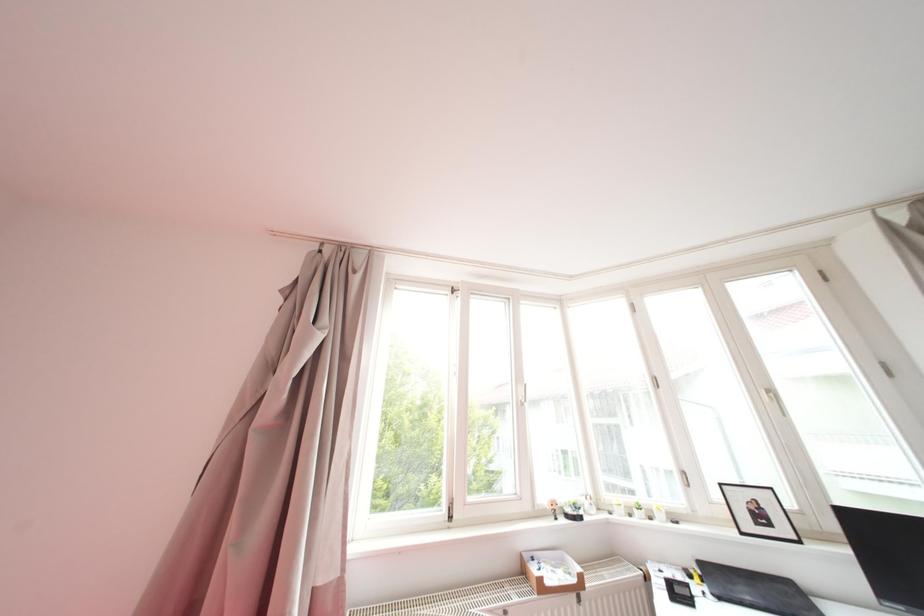
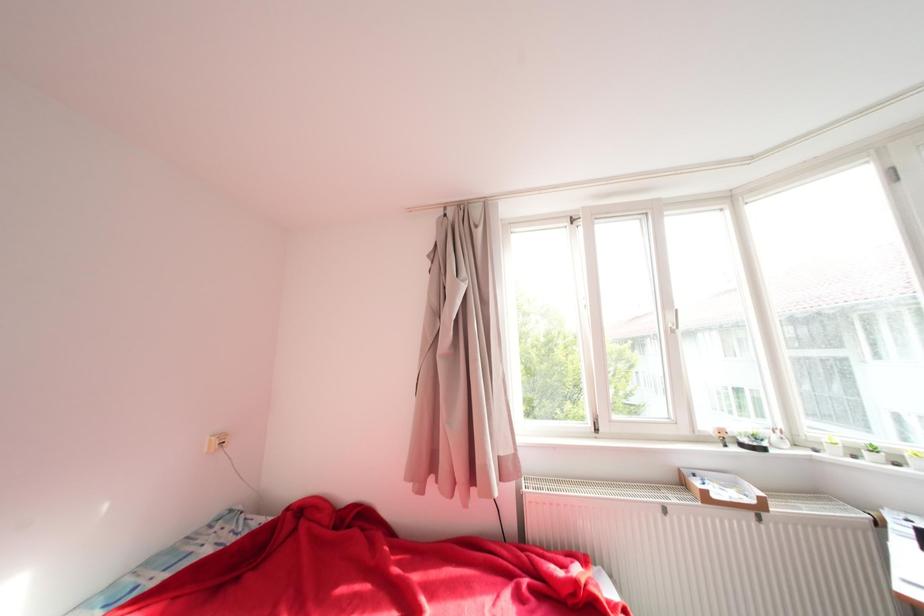
Question: Based on the continuous images, in which direction is the camera rotating? Reply with the corresponding letter.

Choices:
 (A) Left
 (B) Right
 (C) Up
 (D) Down

Answer: (A)